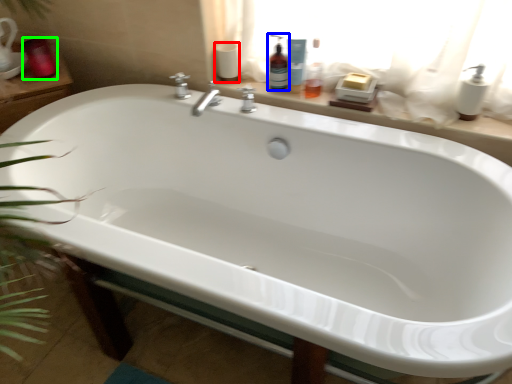
Question: Estimate the real-world distances between objects in this image. Which object is farther from toilet paper (highlighted by a red box), cleaning product (highlighted by a blue box) or toiletry (highlighted by a green box)?

Choices:
 (A) cleaning product
 (B) toiletry

Answer: (B)